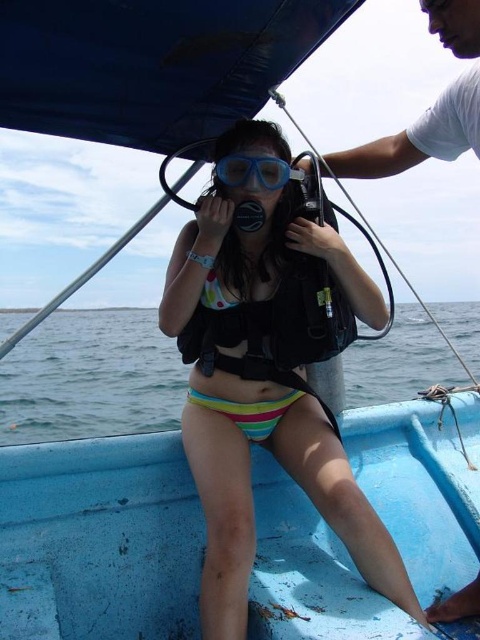
Question: Which point appears closest to the camera in this image?

Choices:
 (A) (470, 10)
 (B) (55, 397)
 (C) (272, 420)

Answer: (A)

Question: Does multicolored bikini at center lie in front of clear blue water at center?

Choices:
 (A) no
 (B) yes

Answer: (B)

Question: Is multicolored bikini at center thinner than clear blue water at center?

Choices:
 (A) yes
 (B) no

Answer: (A)

Question: Which point is closer to the camera?

Choices:
 (A) blue matte scuba mask at center
 (B) clear blue water at center
 (C) multicolored bikini at center

Answer: (C)

Question: Is multicolored fabric bikini at center bigger than blue matte scuba mask at center?

Choices:
 (A) no
 (B) yes

Answer: (B)

Question: Among these objects, which one is farthest from the camera?

Choices:
 (A) multicolored bikini at center
 (B) clear blue water at center
 (C) multicolored fabric bikini at center
 (D) blue matte scuba mask at center

Answer: (B)